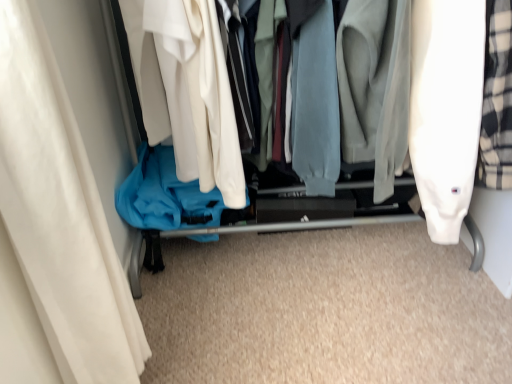
Question: Is white fabric curtain at left inside the boundaries of matte blue fabric at center, or outside?

Choices:
 (A) inside
 (B) outside

Answer: (B)

Question: Is white fabric curtain at left wider or thinner than matte blue fabric at center?

Choices:
 (A) wide
 (B) thin

Answer: (B)

Question: Considering the positions of white fabric curtain at left and matte blue fabric at center in the image, is white fabric curtain at left taller or shorter than matte blue fabric at center?

Choices:
 (A) tall
 (B) short

Answer: (B)

Question: Considering the positions of matte blue fabric at center and white fabric curtain at left in the image, is matte blue fabric at center wider or thinner than white fabric curtain at left?

Choices:
 (A) wide
 (B) thin

Answer: (A)

Question: Is matte blue fabric at center to the left or to the right of white fabric curtain at left in the image?

Choices:
 (A) left
 (B) right

Answer: (B)

Question: Is matte blue fabric at center taller or shorter than white fabric curtain at left?

Choices:
 (A) short
 (B) tall

Answer: (B)

Question: Is matte blue fabric at center bigger or smaller than white fabric curtain at left?

Choices:
 (A) small
 (B) big

Answer: (B)